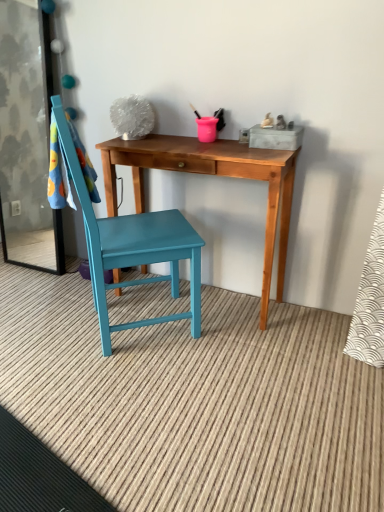
Where is `vacant space in wooden desk at center (from a real-world perspective)`? This screenshot has height=512, width=384. vacant space in wooden desk at center (from a real-world perspective) is located at coordinates (212, 300).